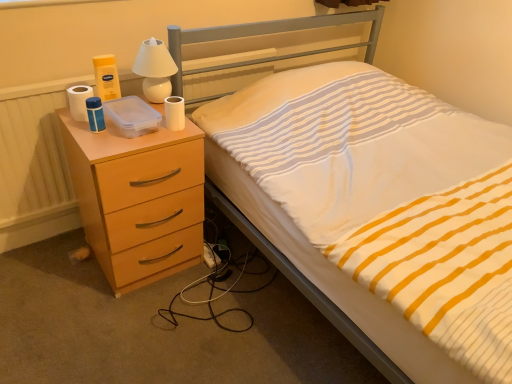
Question: Looking at their shapes, would you say white matte toilet paper at upper right, the 1th toilet paper from the right, is wider or thinner than white striped fabric at center?

Choices:
 (A) wide
 (B) thin

Answer: (B)

Question: Is white matte toilet paper at upper right, which is counted as the 2th toilet paper, starting from the left, inside or outside of white striped fabric at center?

Choices:
 (A) inside
 (B) outside

Answer: (B)

Question: Estimate the real-world distances between objects in this image. Which object is closer to the white glossy lamp at upper center?

Choices:
 (A) peach wood chest of drawers at left
 (B) white striped fabric at center
 (C) white matte toilet paper at upper right, which is counted as the 2th toilet paper, starting from the left
 (D) white matte toilet paper at left, which ranks as the second toilet paper in right-to-left order

Answer: (C)

Question: Based on their relative distances, which object is farther from the white glossy lamp at upper center?

Choices:
 (A) peach wood chest of drawers at left
 (B) white matte toilet paper at left, acting as the 1th toilet paper starting from the left
 (C) white striped fabric at center
 (D) white matte toilet paper at upper right, the 1th toilet paper from the right

Answer: (C)